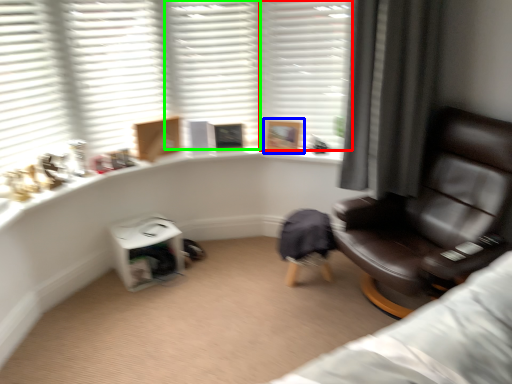
Question: Which object is the closest to the shutter (highlighted by a red box)? Choose among these: picture frame (highlighted by a blue box) or shutter (highlighted by a green box).

Choices:
 (A) picture frame
 (B) shutter

Answer: (B)